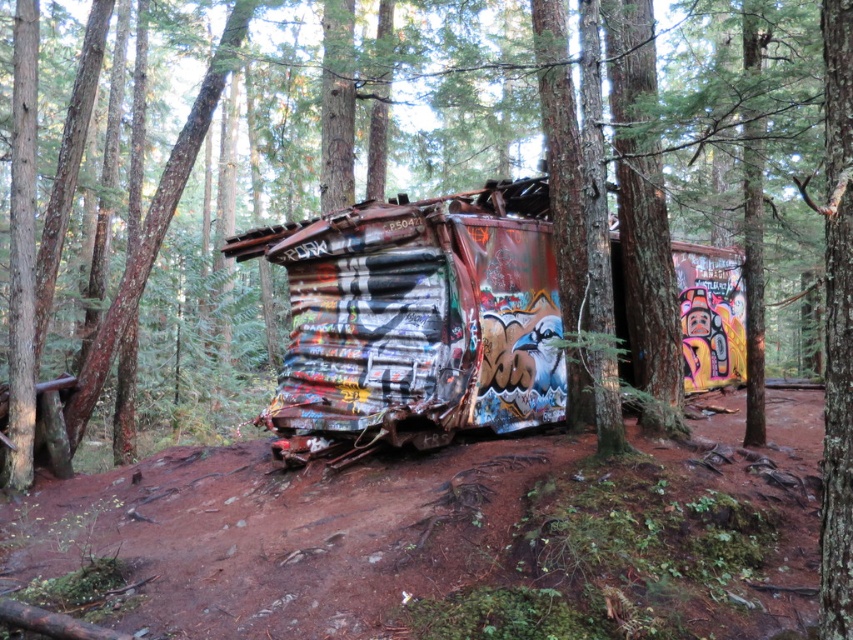
You are hiking through the forest and come across the structure. You see the brown dirt track at center and the rusty corrugated metal train car at center. Which one is positioned to the left from your viewpoint?

The brown dirt track at center is to the left of the rusty corrugated metal train car at center, so the brown dirt track at center is positioned to the left from your viewpoint.

You are a hiker who wants to walk along the brown dirt track at center. You see the rusty corrugated metal train car at center above you. Is the train car blocking your path?

The brown dirt track at center is located below the rusty corrugated metal train car at center, so the train car is blocking your path.